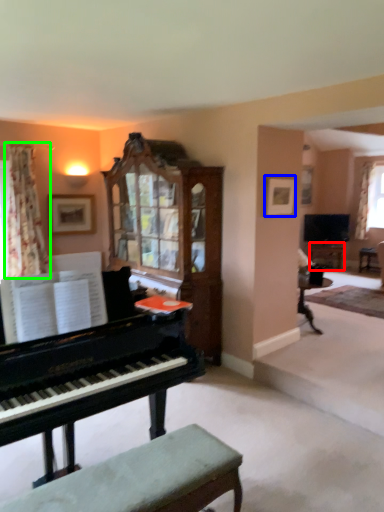
Question: Based on their relative distances, which object is nearer to table (highlighted by a red box)? Choose from picture frame (highlighted by a blue box) and curtain (highlighted by a green box).

Choices:
 (A) picture frame
 (B) curtain

Answer: (A)